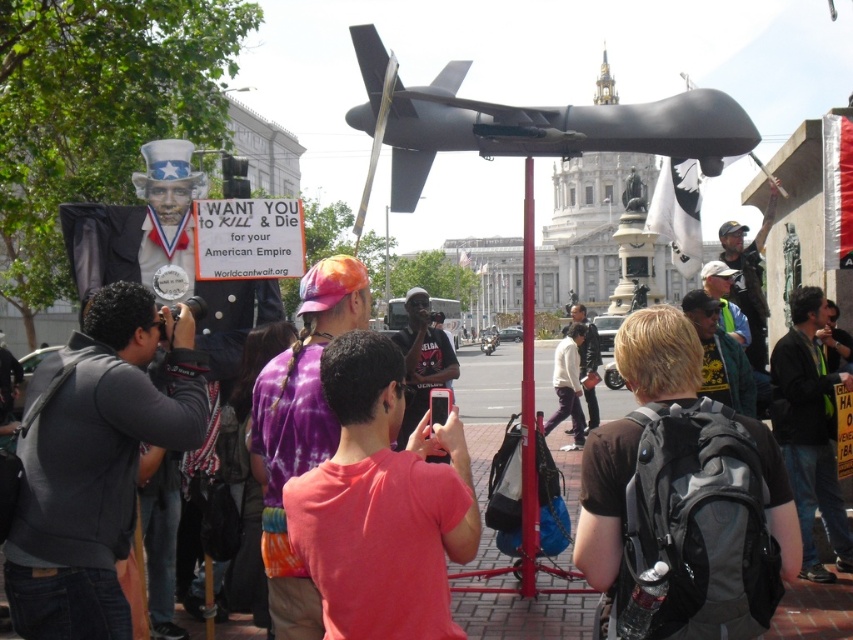
You are a photographer at the protest and you need to capture both the blonde synthetic hair at center and the black synthetic wig at lower left in your shot. Which object should you focus on first to ensure both are in frame?

You should focus on the blonde synthetic hair at center first because it is larger than the black synthetic wig at lower left, so centering it will help ensure both objects fit within the frame.

You are standing at the protest and want to move from the point at coordinates point (312, 625) to the point at coordinates point (627, 349). Which direction should you move to get closer to your destination?

Since point (312, 625) is in front of point (627, 349), you should move backward to reach your destination.